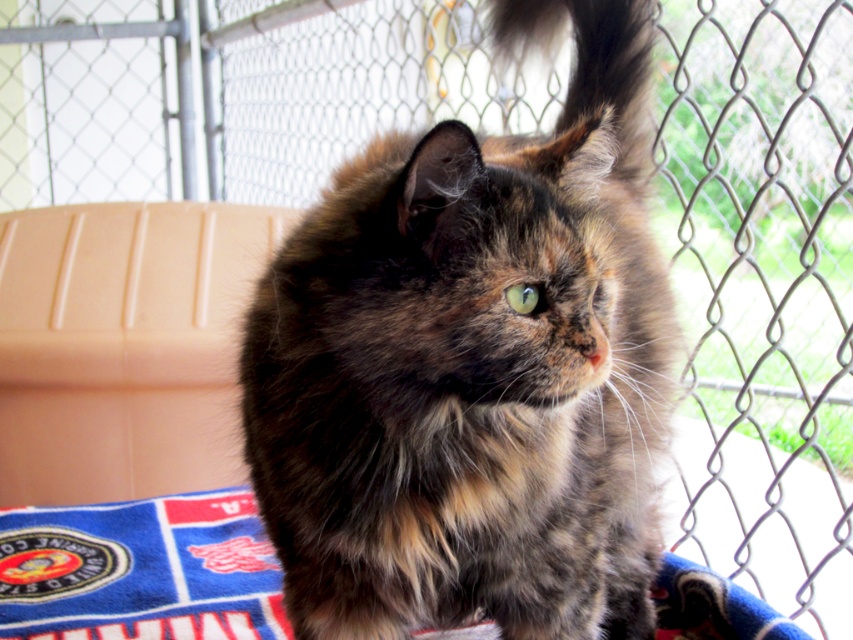
Question: Is fluffy tortoiseshell cat at center to the right of fluffy tortoiseshell tail at upper right from the viewer's perspective?

Choices:
 (A) yes
 (B) no

Answer: (B)

Question: Can you confirm if fluffy tortoiseshell cat at center is wider than blue fleece mat at center?

Choices:
 (A) no
 (B) yes

Answer: (A)

Question: Based on their relative distances, which object is farther from the blue fleece mat at center?

Choices:
 (A) fluffy tortoiseshell cat at center
 (B) fluffy tortoiseshell tail at upper right

Answer: (B)

Question: Is blue fleece mat at center closer to camera compared to fluffy tortoiseshell tail at upper right?

Choices:
 (A) yes
 (B) no

Answer: (A)

Question: Which point is farther to the camera?

Choices:
 (A) (599, 54)
 (B) (326, 408)

Answer: (A)

Question: Which point is closer to the camera?

Choices:
 (A) (76, 570)
 (B) (363, 276)
 (C) (606, 33)

Answer: (B)